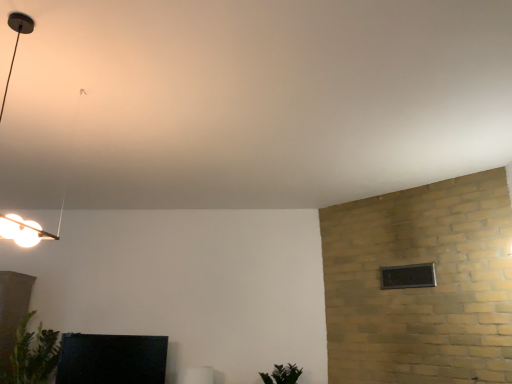
Question: Considering the relative sizes of green leafy plant at lower left, positioned as the 2th plant in right-to-left order, and matte black tv at lower left, which is counted as the 1th furniture, starting from the left, in the image provided, is green leafy plant at lower left, positioned as the 2th plant in right-to-left order, bigger than matte black tv at lower left, which is counted as the 1th furniture, starting from the left,?

Choices:
 (A) no
 (B) yes

Answer: (B)

Question: Is green leafy plant at lower left, acting as the first plant starting from the left, to the left of matte black tv at lower left, the 2th furniture from the right, from the viewer's perspective?

Choices:
 (A) no
 (B) yes

Answer: (B)

Question: Is green leafy plant at lower left, acting as the first plant starting from the left, to the right of matte black tv at lower left, which is counted as the 1th furniture, starting from the left, from the viewer's perspective?

Choices:
 (A) no
 (B) yes

Answer: (A)

Question: Can you confirm if green leafy plant at lower left, positioned as the 2th plant in right-to-left order, is shorter than matte black tv at lower left, which is counted as the 1th furniture, starting from the left?

Choices:
 (A) yes
 (B) no

Answer: (B)

Question: From the image's perspective, would you say green leafy plant at lower left, acting as the first plant starting from the left, is shown under matte black tv at lower left, the 2th furniture from the right?

Choices:
 (A) no
 (B) yes

Answer: (A)

Question: Is point (190, 380) positioned closer to the camera than point (279, 374)?

Choices:
 (A) farther
 (B) closer

Answer: (B)

Question: Is white glossy frame at lower center, the 2th furniture in the left-to-right sequence, wider or thinner than green matte plant at lower center, which ranks as the second plant in left-to-right order?

Choices:
 (A) wide
 (B) thin

Answer: (B)

Question: Is white glossy frame at lower center, the 2th furniture in the left-to-right sequence, bigger or smaller than green matte plant at lower center, which ranks as the second plant in left-to-right order?

Choices:
 (A) big
 (B) small

Answer: (B)

Question: Is white glossy frame at lower center, arranged as the 1th furniture when viewed from the right, to the left or to the right of green matte plant at lower center, which ranks as the second plant in left-to-right order, in the image?

Choices:
 (A) right
 (B) left

Answer: (B)

Question: From the image's perspective, is green leafy plant at lower left, positioned as the 2th plant in right-to-left order, positioned above or below matte black tv at lower left, which is counted as the 1th furniture, starting from the left?

Choices:
 (A) below
 (B) above

Answer: (B)

Question: Is point (14, 370) closer or farther from the camera than point (103, 382)?

Choices:
 (A) closer
 (B) farther

Answer: (A)

Question: Looking at their shapes, would you say green leafy plant at lower left, acting as the first plant starting from the left, is wider or thinner than matte black tv at lower left, which is counted as the 1th furniture, starting from the left?

Choices:
 (A) wide
 (B) thin

Answer: (A)

Question: Considering the positions of green leafy plant at lower left, positioned as the 2th plant in right-to-left order, and matte black tv at lower left, the 2th furniture from the right, in the image, is green leafy plant at lower left, positioned as the 2th plant in right-to-left order, bigger or smaller than matte black tv at lower left, the 2th furniture from the right,?

Choices:
 (A) small
 (B) big

Answer: (B)

Question: In terms of height, does green leafy plant at lower left, acting as the first plant starting from the left, look taller or shorter compared to black glass window at upper right?

Choices:
 (A) short
 (B) tall

Answer: (B)

Question: Would you say green leafy plant at lower left, positioned as the 2th plant in right-to-left order, is to the left or to the right of black glass window at upper right in the picture?

Choices:
 (A) right
 (B) left

Answer: (B)